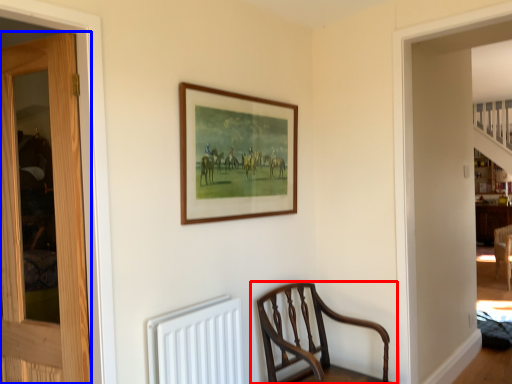
Question: Which point is closer to the camera, chair (highlighted by a red box) or door (highlighted by a blue box)?

Choices:
 (A) chair
 (B) door

Answer: (B)